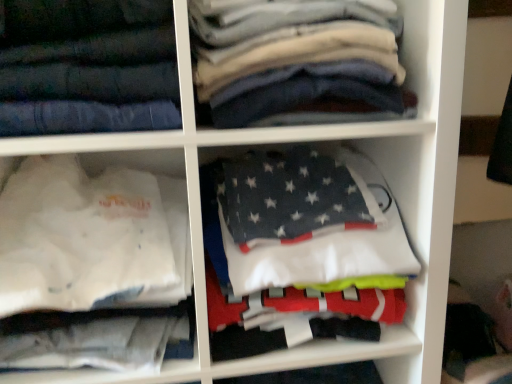
Question: Looking at their shapes, would you say dark gray fleece blanket at center, the first cabinet positioned from the right, is wider or thinner than white fabric shirt at lower left, the 2th cabinet from the right?

Choices:
 (A) wide
 (B) thin

Answer: (B)

Question: In terms of size, does dark gray fleece blanket at center, the first cabinet positioned from the right, appear bigger or smaller than white fabric shirt at lower left, marked as the first cabinet in a left-to-right arrangement?

Choices:
 (A) small
 (B) big

Answer: (A)

Question: Estimate the real-world distances between objects in this image. Which object is farther from the white fabric shirt at lower left, marked as the first cabinet in a left-to-right arrangement?

Choices:
 (A) dark gray fleece blanket at center, the 2th cabinet in the left-to-right sequence
 (B) dark gray cotton shirts at upper center
 (C) dark blue denim jeans at upper left

Answer: (B)

Question: Which of these objects is positioned farthest from the dark gray cotton shirts at upper center?

Choices:
 (A) white fabric shirt at lower left, the 2th cabinet from the right
 (B) dark gray fleece blanket at center, the first cabinet positioned from the right
 (C) dark blue denim jeans at upper left

Answer: (A)